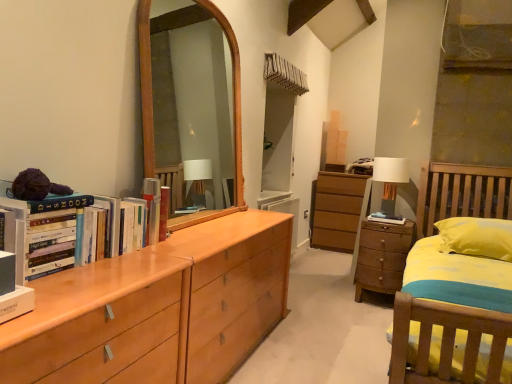
Question: Looking at the image, does white fabric lampshade at right seem bigger or smaller compared to wooden chest of drawers at right?

Choices:
 (A) small
 (B) big

Answer: (A)

Question: From their relative heights in the image, would you say white fabric lampshade at right is taller or shorter than wooden chest of drawers at right?

Choices:
 (A) tall
 (B) short

Answer: (B)

Question: Considering their positions, is white fabric lampshade at right located in front of or behind wooden chest of drawers at right?

Choices:
 (A) behind
 (B) front

Answer: (A)

Question: From the image's perspective, is wooden chest of drawers at right positioned above or below white fabric lampshade at right?

Choices:
 (A) below
 (B) above

Answer: (A)

Question: Is wooden chest of drawers at right spatially inside white fabric lampshade at right, or outside of it?

Choices:
 (A) outside
 (B) inside

Answer: (A)

Question: From a real-world perspective, relative to white fabric lampshade at right, is wooden chest of drawers at right vertically above or below?

Choices:
 (A) above
 (B) below

Answer: (B)

Question: Visually, is wooden chest of drawers at right positioned to the left or to the right of white fabric lampshade at right?

Choices:
 (A) right
 (B) left

Answer: (B)